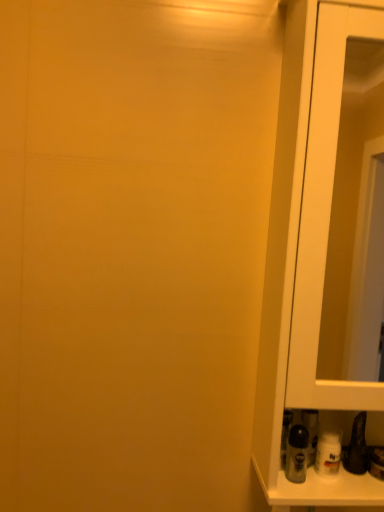
What do you see at coordinates (324, 248) in the screenshot?
I see `white glossy cabinet at right` at bounding box center [324, 248].

Find the location of a particular element. Image resolution: width=384 pixels, height=512 pixels. white glossy cabinet at right is located at coordinates (324, 248).

Where is `white glossy cabinet at right`? white glossy cabinet at right is located at coordinates (324, 248).